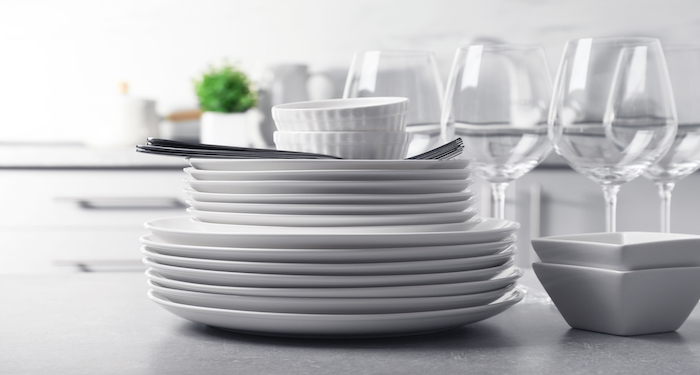
Where is `utensil`? utensil is located at coordinates (175, 138), (160, 150), (176, 149), (201, 149).